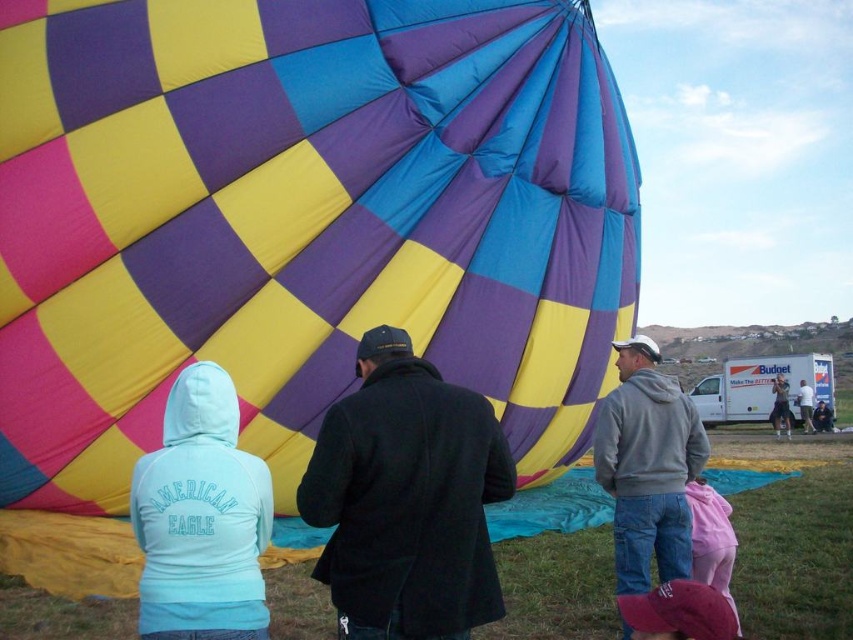
Question: Is light blue hoodie at lower left to the left of denim jacket at lower right from the viewer's perspective?

Choices:
 (A) yes
 (B) no

Answer: (A)

Question: Which object is closer to the camera taking this photo?

Choices:
 (A) light blue hoodie at center
 (B) checkered fabric hot air balloon at center
 (C) gray fleece jacket at right
 (D) dark blue jacket at center

Answer: (C)

Question: Does light blue hoodie at lower left have a smaller size compared to light blue hoodie at center?

Choices:
 (A) no
 (B) yes

Answer: (A)

Question: Which point is closer to the camera taking this photo?

Choices:
 (A) (204, 13)
 (B) (824, 428)

Answer: (A)

Question: Which object appears closest to the camera in this image?

Choices:
 (A) pink fabric cap at lower center
 (B) dark blue jacket at center
 (C) denim jacket at lower right
 (D) light blue hoodie at center

Answer: (A)

Question: Can you confirm if black wool coat at center is positioned below light blue hoodie at center?

Choices:
 (A) yes
 (B) no

Answer: (B)